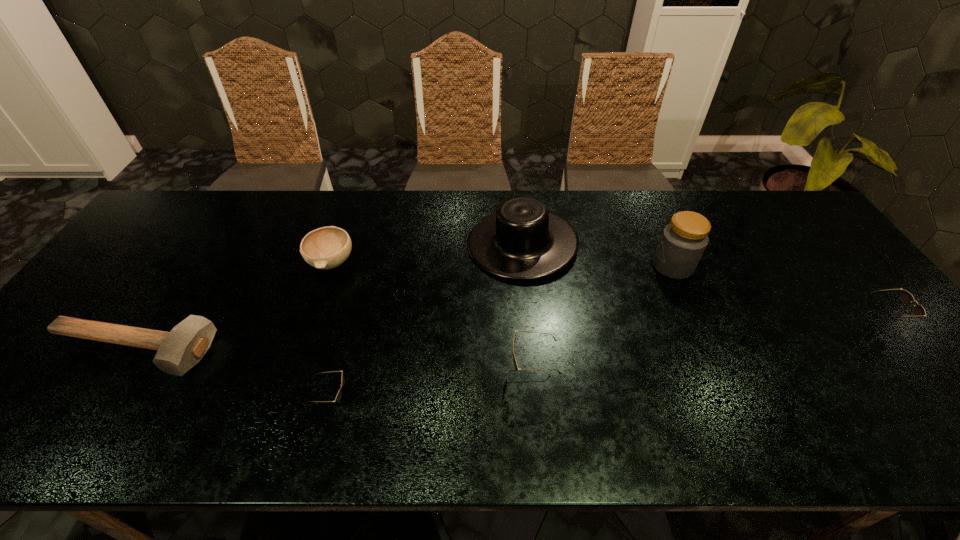
Where is `spot to insert another sunglasses for uniform distribution`? This screenshot has width=960, height=540. spot to insert another sunglasses for uniform distribution is located at coordinates (714, 346).